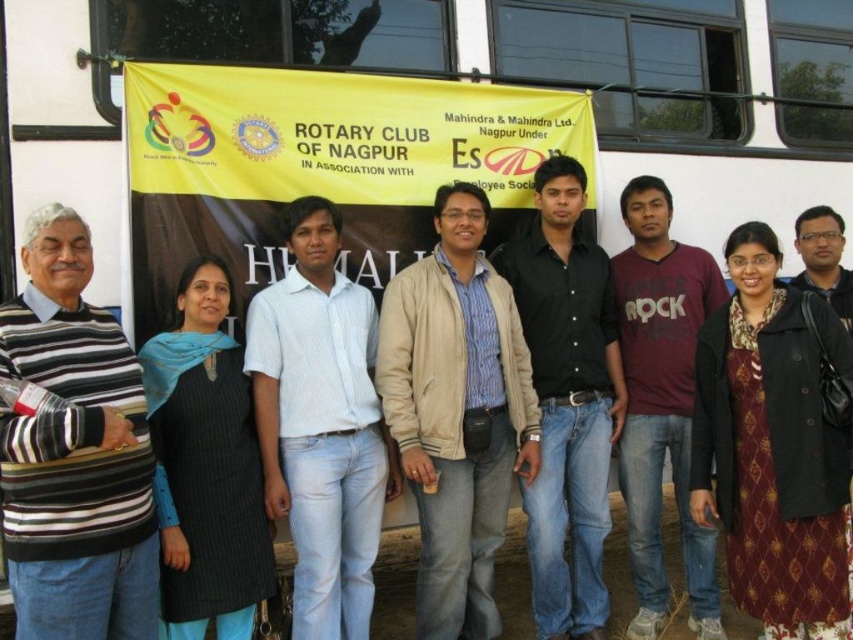
I want to click on maroon silk dress at center, so click(x=773, y=445).

Which is behind, point (410, 380) or point (808, 232)?

The point (808, 232) is more distant.

Is beige cotton jacket at center taller than dark brown leather jacket at right?

Yes, beige cotton jacket at center is taller than dark brown leather jacket at right.

I want to click on beige cotton jacket at center, so click(x=457, y=412).

Can you confirm if striped sweater at left is positioned above beige cotton jacket at center?

Indeed, striped sweater at left is positioned over beige cotton jacket at center.

Between point (76, 310) and point (434, 413), which one is positioned in front?

Point (76, 310) is more forward.

Locate an element on the screen. Image resolution: width=853 pixels, height=640 pixels. striped sweater at left is located at coordinates (74, 452).